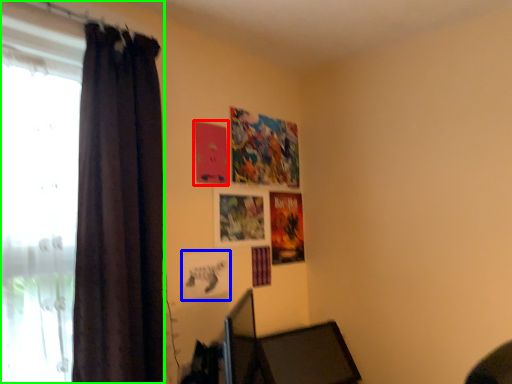
Question: Which object is the farthest from poster page (highlighted by a red box)? Choose among these: picture frame (highlighted by a blue box) or curtain (highlighted by a green box).

Choices:
 (A) picture frame
 (B) curtain

Answer: (B)